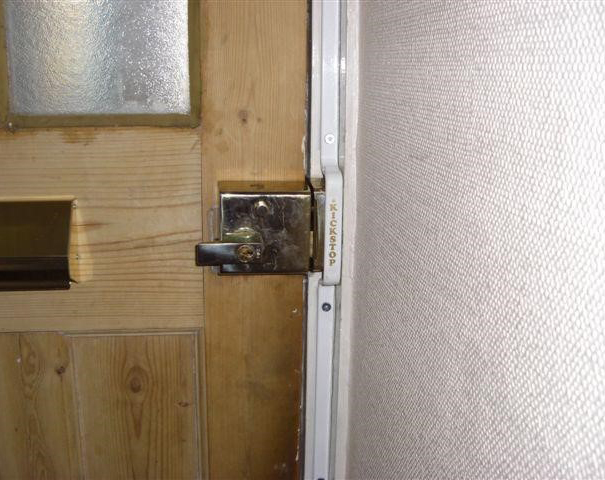
In order to click on keyhole in this screenshot , I will do `click(252, 255)`.